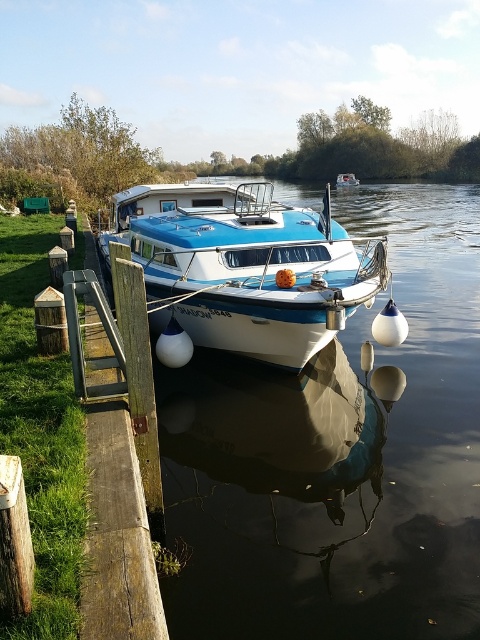
Which is more to the left, blue glossy houseboat at center or blue glossy boat at center?

blue glossy houseboat at center is more to the left.

Is blue glossy houseboat at center closer to the viewer compared to blue glossy boat at center?

That is True.

Identify the location of blue glossy houseboat at center. (244, 266).

Can you confirm if glossy white boat at center is positioned to the right of blue glossy houseboat at center?

Indeed, glossy white boat at center is positioned on the right side of blue glossy houseboat at center.

Can you confirm if glossy white boat at center is positioned above blue glossy houseboat at center?

Indeed, glossy white boat at center is positioned over blue glossy houseboat at center.

Does point (338, 344) come farther from viewer compared to point (277, 259)?

Yes, point (338, 344) is behind point (277, 259).

At what (x,y) coordinates should I click in order to perform the action: click on glossy white boat at center. Please return your answer as a coordinate pair (x, y). Image resolution: width=480 pixels, height=640 pixels. Looking at the image, I should click on tap(338, 458).

Is point (476, 355) in front of point (347, 182)?

That is True.

Which is more to the left, glossy white boat at center or blue glossy boat at center?

From the viewer's perspective, glossy white boat at center appears more on the left side.

Identify the location of glossy white boat at center. (338, 458).

I want to click on glossy white boat at center, so click(338, 458).